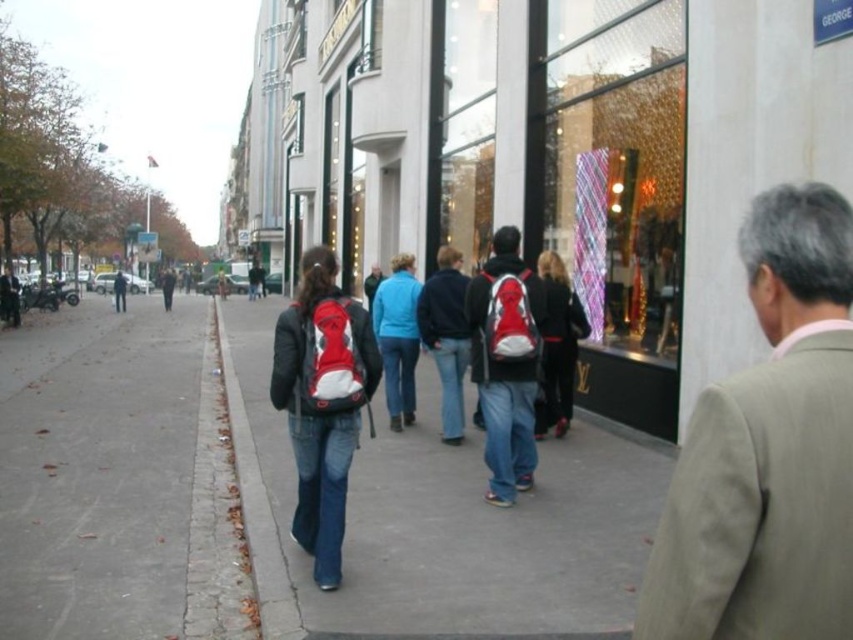
Between point (672, 68) and point (520, 461), which one is positioned in front?

Point (520, 461)

Image resolution: width=853 pixels, height=640 pixels. Describe the element at coordinates (618, 164) in the screenshot. I see `translucent glass display at center` at that location.

Between point (592, 144) and point (502, 284), which one is positioned in front?

Point (502, 284) is in front.

Image resolution: width=853 pixels, height=640 pixels. In order to click on translucent glass display at center in this screenshot , I will do `click(618, 164)`.

Can you confirm if denim at center is positioned to the right of matte black backpack at center?

Indeed, denim at center is positioned on the right side of matte black backpack at center.

Who is more distant from viewer, (430, 490) or (297, 416)?

The point (430, 490) is behind.

Which is in front, point (450, 593) or point (326, 524)?

Point (450, 593) is more forward.

The height and width of the screenshot is (640, 853). In order to click on denim at center in this screenshot , I will do `click(460, 522)`.

Between denim at center and light brown suit at right, which one has more height?

denim at center

Between denim at center and light brown suit at right, which one is positioned higher?

Positioned higher is light brown suit at right.

At what (x,y) coordinates should I click in order to perform the action: click on denim at center. Please return your answer as a coordinate pair (x, y). The height and width of the screenshot is (640, 853). Looking at the image, I should click on pos(460,522).

I want to click on denim at center, so click(460, 522).